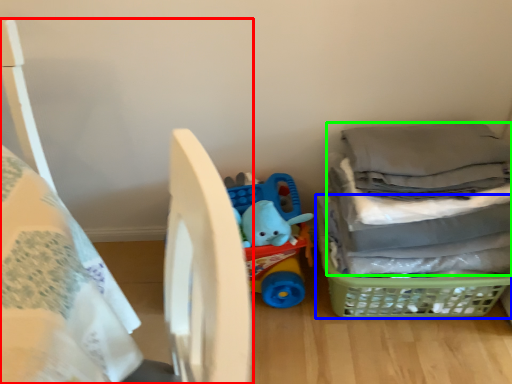
Question: Considering the real-world distances, which object is farthest from bed (highlighted by a red box)? basket (highlighted by a blue box) or laundry (highlighted by a green box)?

Choices:
 (A) basket
 (B) laundry

Answer: (A)